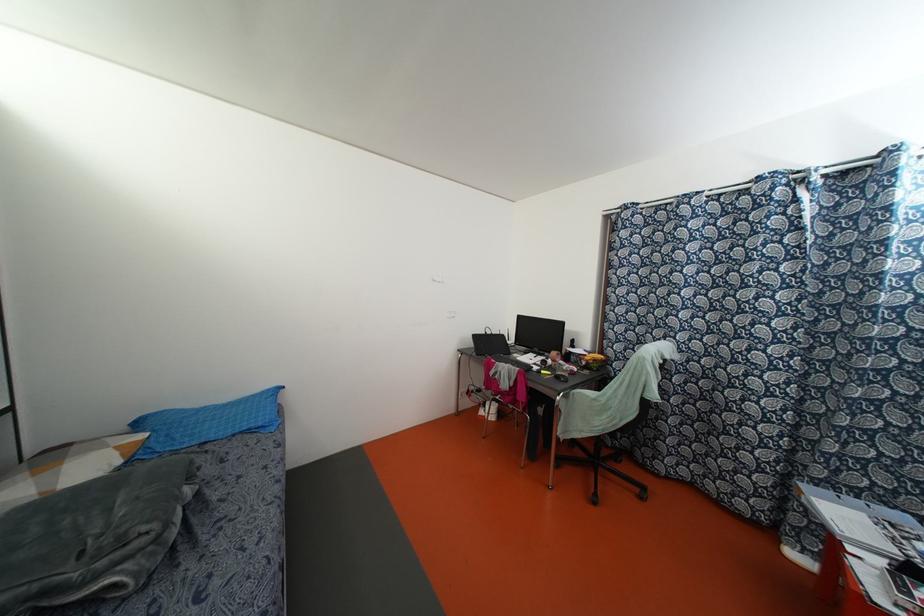
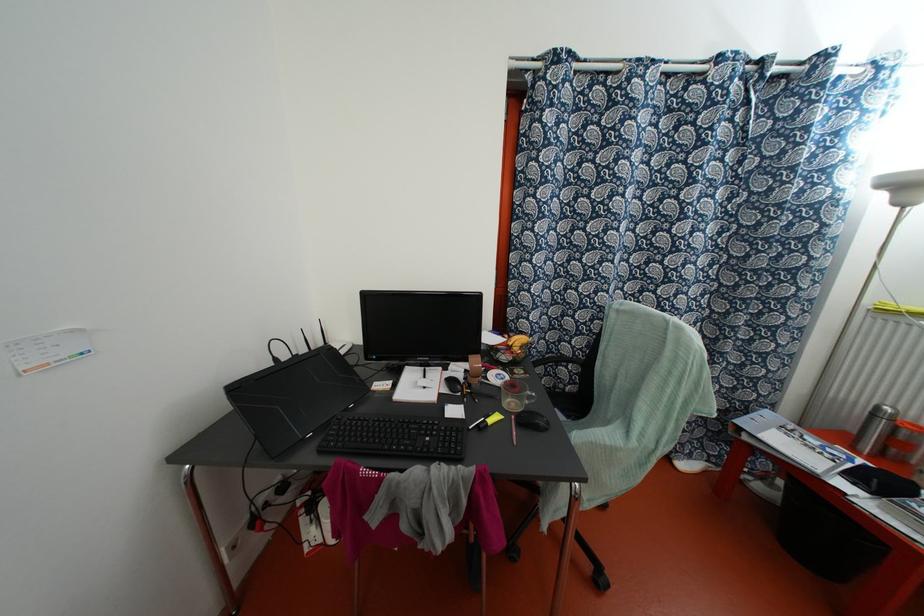
Find the pixel in the second image that matches pixel 542 371 in the first image.

(489, 421)